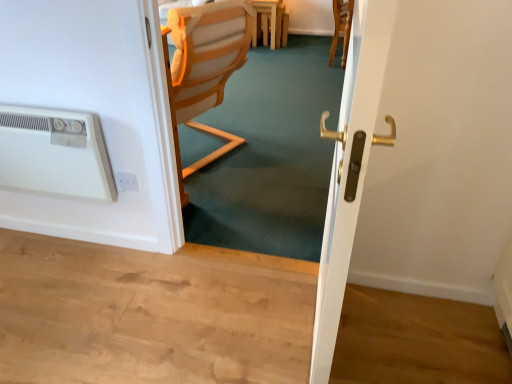
Identify the location of free point below white plastic air conditioning unit at left (from a real-world perspective). The height and width of the screenshot is (384, 512). (74, 238).